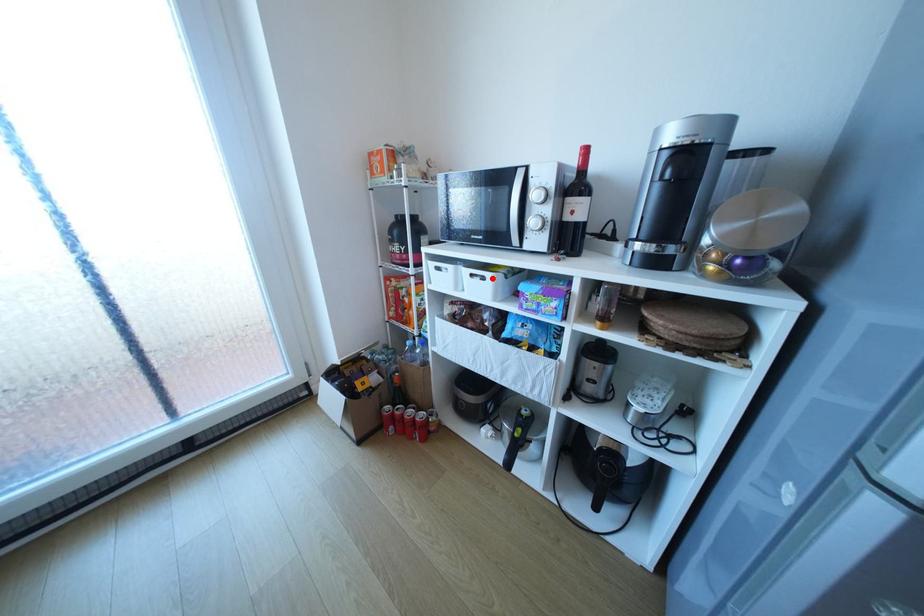
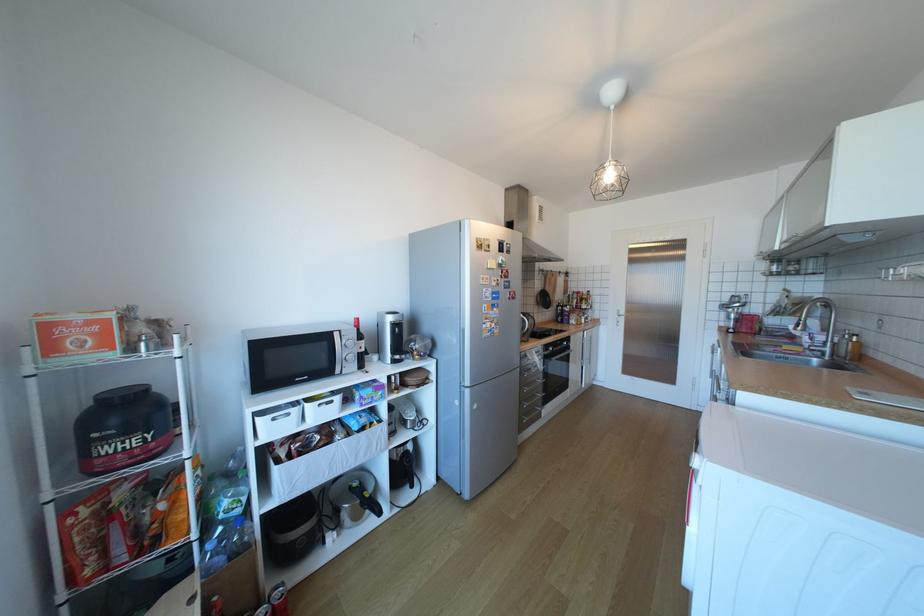
Where in the second image is the point corresponding to the highlighted location from the first image?

(341, 402)